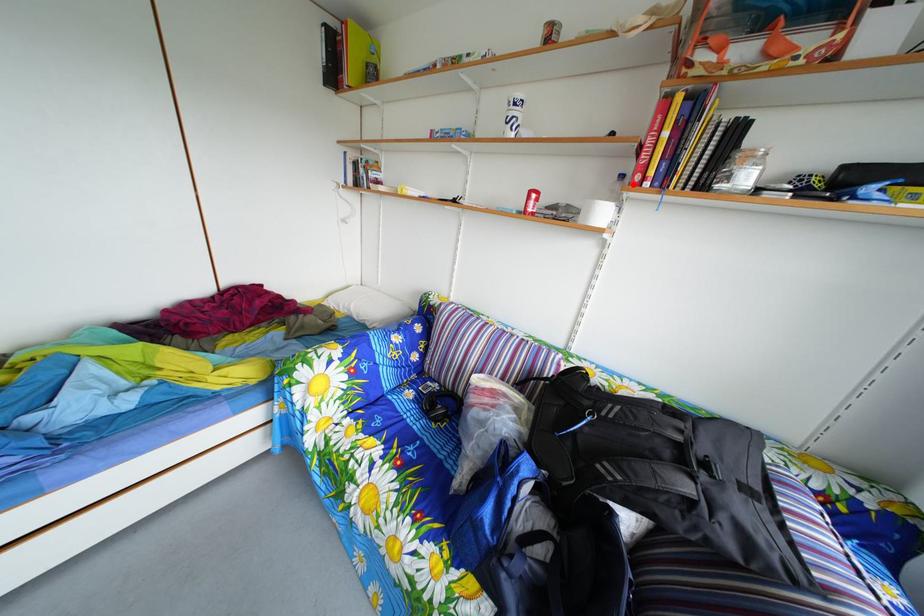
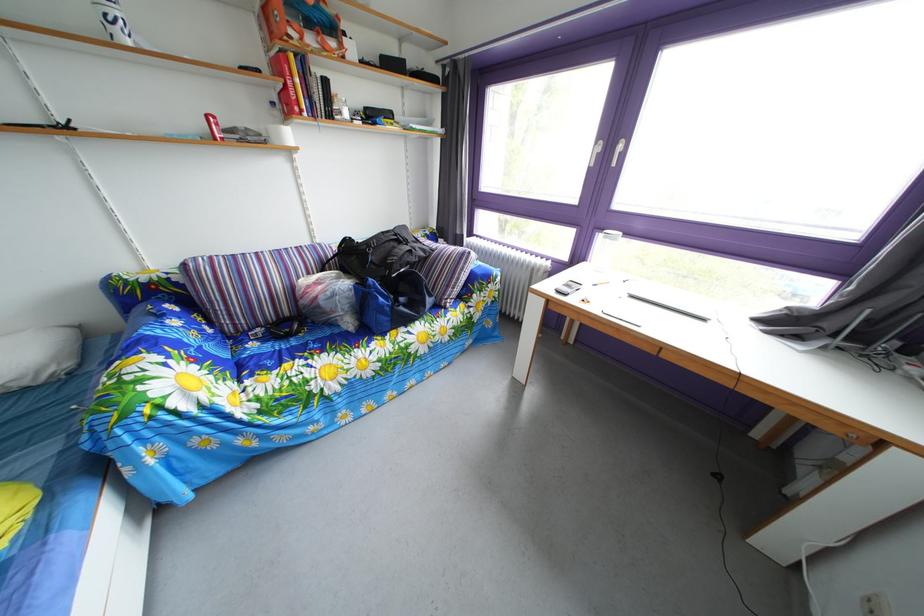
Locate, in the second image, the point that corresponds to the highlighted location in the first image.

(284, 111)